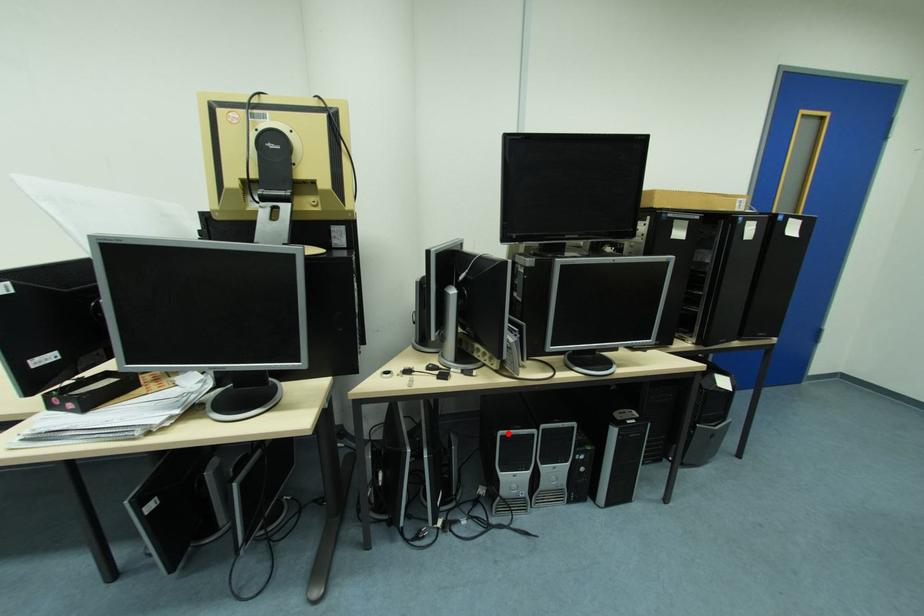
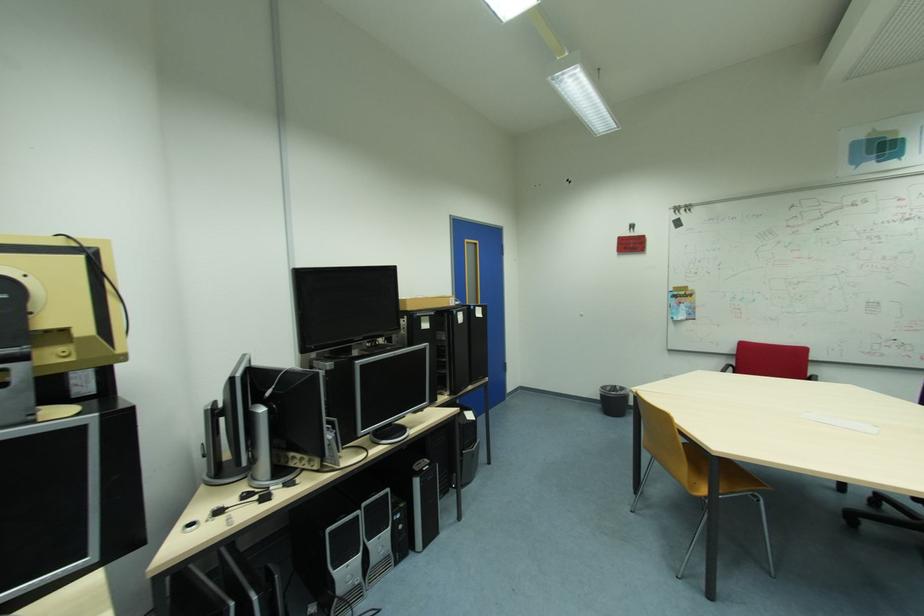
Find the pixel in the second image that matches the highlighted location in the first image.

(335, 530)